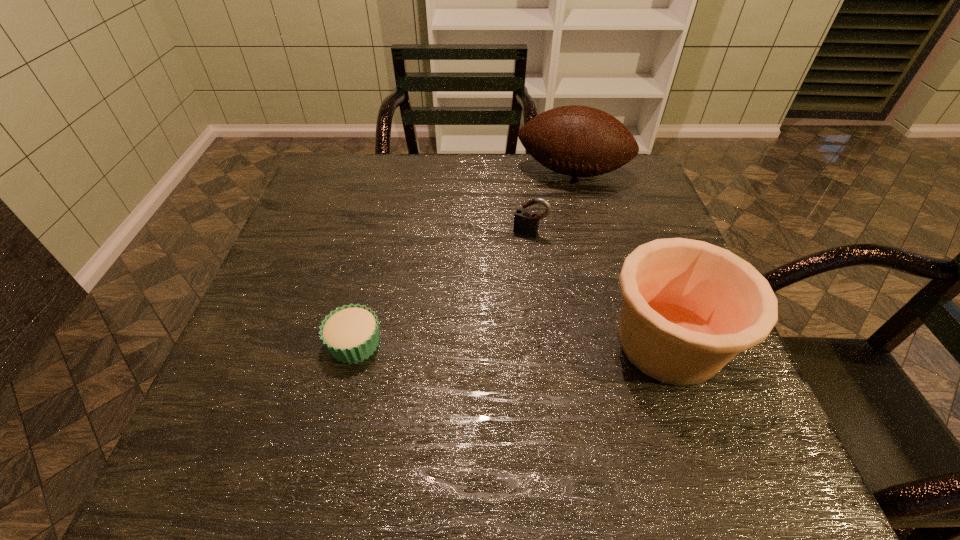
Image resolution: width=960 pixels, height=540 pixels. In order to click on blank area in the image that satisfies the following two spatial constraints: 1. on the front side of the third shortest object; 2. on the right side of the football in this screenshot , I will do `click(617, 343)`.